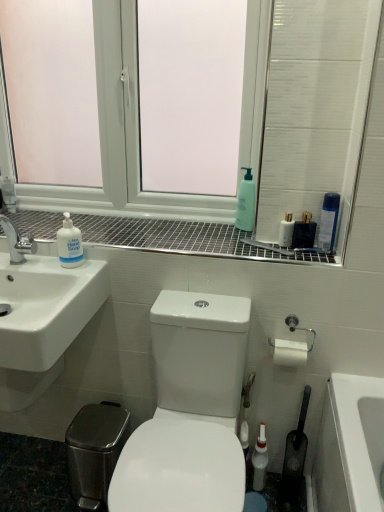
Question: Would you say white glossy bottle at lower center, acting as the third mouthwash starting from the right, is inside or outside white plastic window at upper center?

Choices:
 (A) outside
 (B) inside

Answer: (A)

Question: From a real-world perspective, is white glossy bottle at lower center, acting as the third mouthwash starting from the right, above or below white plastic window at upper center?

Choices:
 (A) below
 (B) above

Answer: (A)

Question: Which object is the farthest from the white matte hand soap at left, the second cleaning product positioned from the right?

Choices:
 (A) white glossy bottle at lower center, which appears as the 1th mouthwash when viewed from the left
 (B) white glossy sink at lower left
 (C) clear plastic spray bottle at upper right, which appears as the first cleaning product when viewed from the right
 (D) white glossy mouthwash at upper right, marked as the second mouthwash in a right-to-left arrangement
 (E) white plastic window at upper center

Answer: (A)

Question: Estimate the real-world distances between objects in this image. Which object is farther from the white matte hand soap at left, which is the 1th cleaning product from left to right?

Choices:
 (A) white glossy mouthwash at upper right, positioned as the 2th mouthwash in bottom-to-top order
 (B) white glossy toilet at center
 (C) white glossy sink at upper left
 (D) white glossy bottle at lower center, arranged as the first mouthwash when ordered from the bottom
 (E) green matte bottle at upper center

Answer: (D)